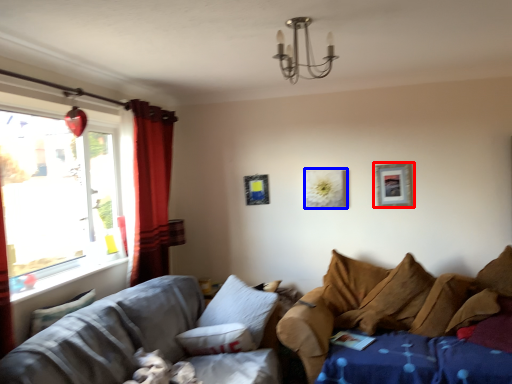
Question: Among these objects, which one is farthest to the camera, picture frame (highlighted by a red box) or picture frame (highlighted by a blue box)?

Choices:
 (A) picture frame
 (B) picture frame

Answer: (B)